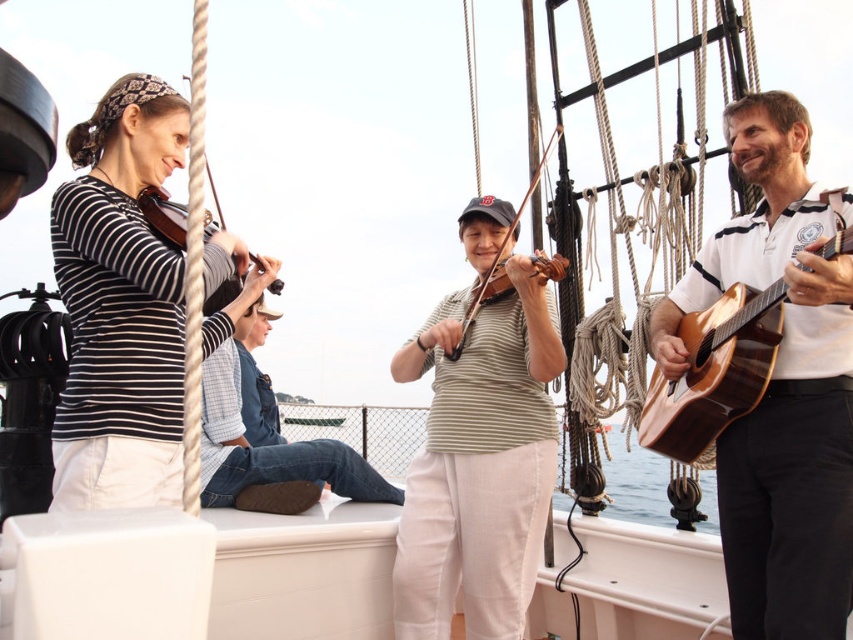
You are standing on the deck of the sailboat and want to hand the natural wood acoustic guitar at right to the person wearing the green striped shirt at center. Can you directly hand it to them without moving either object?

The green striped shirt at center is located below the natural wood acoustic guitar at right, so yes, you can directly hand the natural wood acoustic guitar at right to the person wearing the green striped shirt at center since they are positioned in a vertical alignment.

You are standing on the deck of the sailboat and want to place a new item between the denim jeans at center and the natural wood acoustic guitar at right. Based on their positions, where should you place the item so it is between them?

The denim jeans at center is below the natural wood acoustic guitar at right, so placing the item between them would require positioning it above the denim jeans at center and below the natural wood acoustic guitar at right.

You are a photographer standing on the deck of the sailboat. You want to take a photo of the denim jeans at center and the wooden violin at left. The minimum distance required between the subjects for your camera to focus properly is 3 meters. Can you achieve proper focus with the current positioning?

The denim jeans at center and wooden violin at left are 3.77 meters apart, which exceeds the minimum 3 meters required for proper focus. Therefore, the camera can achieve proper focus with their current positioning.